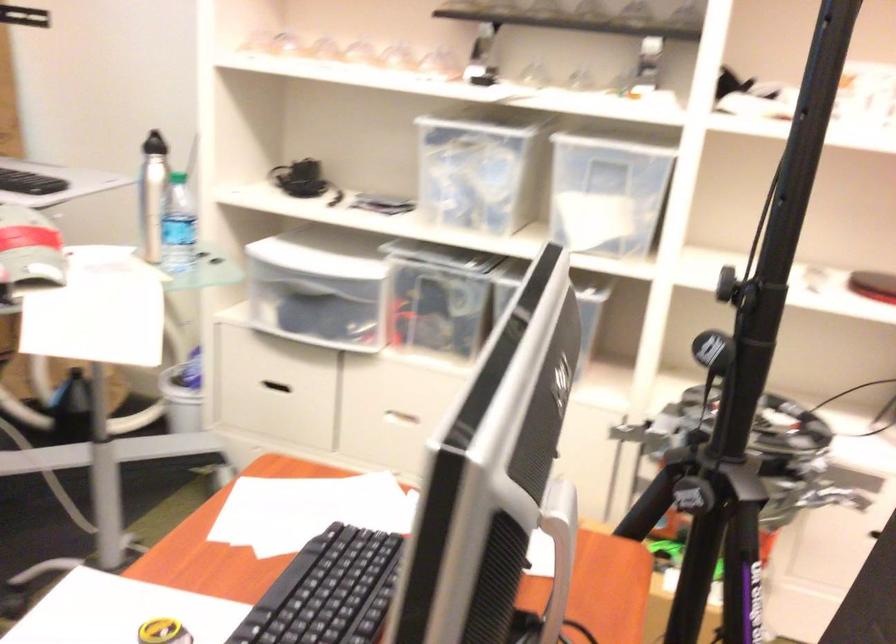
What are the coordinates of `white drawer handle` in the screenshot? It's located at (271, 389).